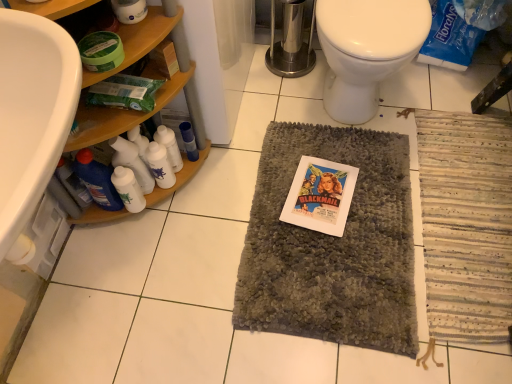
The height and width of the screenshot is (384, 512). I want to click on vacant region under striped fabric bath mat at lower right (from a real-world perspective), so click(474, 225).